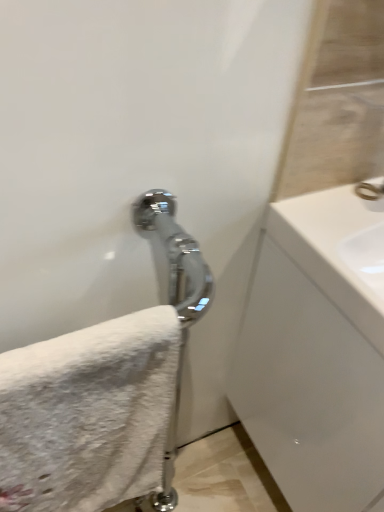
The image size is (384, 512). What do you see at coordinates (369, 191) in the screenshot?
I see `polished chrome faucet at upper right` at bounding box center [369, 191].

The height and width of the screenshot is (512, 384). I want to click on white fluffy towel at lower left, so click(x=88, y=414).

Is white fluffy towel at lower left looking in the opposite direction of polished chrome faucet at upper right?

That's not correct — white fluffy towel at lower left is not looking away from polished chrome faucet at upper right.

Considering the points (30, 501) and (371, 195), which point is in front, point (30, 501) or point (371, 195)?

The point (30, 501) is closer to the camera.

From a real-world perspective, does white fluffy towel at lower left sit lower than polished chrome faucet at upper right?

Yes, from a real-world perspective, white fluffy towel at lower left is below polished chrome faucet at upper right.

From a real-world perspective, does white fluffy towel at lower left stand above white glossy sink at right?

Indeed, from a real-world perspective, white fluffy towel at lower left stands above white glossy sink at right.

Which is nearer, (123, 422) or (340, 259)?

Point (123, 422) is closer to the camera than point (340, 259).

Looking at this image, is white glossy sink at right located within white fluffy towel at lower left?

No.

Is white fluffy towel at lower left beside white glossy sink at right?

white fluffy towel at lower left and white glossy sink at right are clearly separated.

Does point (361, 185) lie behind point (337, 431)?

Yes.

From the image's perspective, relative to white glossy sink at right, is polished chrome faucet at upper right above or below?

Based on their image positions, polished chrome faucet at upper right is located above white glossy sink at right.

From the picture: Between polished chrome faucet at upper right and white glossy sink at right, which one appears on the right side from the viewer's perspective?

white glossy sink at right.

Does white glossy sink at right turn towards polished chrome faucet at upper right?

No, white glossy sink at right is not facing towards polished chrome faucet at upper right.

From the image's perspective, between white glossy sink at right and polished chrome faucet at upper right, which one is located above?

From the image's view, polished chrome faucet at upper right is above.

Based on the photo, who is taller, white glossy sink at right or polished chrome faucet at upper right?

white glossy sink at right is taller.

Does white glossy sink at right lie behind polished chrome faucet at upper right?

No, it is not.

From the image's perspective, is polished chrome faucet at upper right over white fluffy towel at lower left?

Correct, polished chrome faucet at upper right appears higher than white fluffy towel at lower left in the image.

From a real-world perspective, is polished chrome faucet at upper right located higher than white fluffy towel at lower left?

Indeed, from a real-world perspective, polished chrome faucet at upper right stands above white fluffy towel at lower left.

Is polished chrome faucet at upper right behind white fluffy towel at lower left?

Yes, polished chrome faucet at upper right is further from the viewer.

Can you confirm if polished chrome faucet at upper right is shorter than white fluffy towel at lower left?

Yes.

Can you confirm if white glossy sink at right is taller than white fluffy towel at lower left?

Indeed, white glossy sink at right has a greater height compared to white fluffy towel at lower left.

Between white glossy sink at right and white fluffy towel at lower left, which one appears on the left side from the viewer's perspective?

white fluffy towel at lower left.

Looking at this image, is white glossy sink at right oriented towards white fluffy towel at lower left?

No, white glossy sink at right is not facing towards white fluffy towel at lower left.

The image size is (384, 512). I want to click on faucet lying behind the white fluffy towel at lower left, so click(369, 191).

In order to click on towel above the white glossy sink at right (from a real-world perspective) in this screenshot , I will do `click(88, 414)`.

Based on their spatial positions, is polished chrome faucet at upper right or white glossy sink at right closer to white fluffy towel at lower left?

white glossy sink at right is positioned closer to the anchor white fluffy towel at lower left.

When comparing their distances from polished chrome faucet at upper right, does white glossy sink at right or white fluffy towel at lower left seem further?

Among the two, white fluffy towel at lower left is located further to polished chrome faucet at upper right.

Based on the photo, which object lies further to the anchor point white glossy sink at right, polished chrome faucet at upper right or white fluffy towel at lower left?

white fluffy towel at lower left.

Considering their positions, is white fluffy towel at lower left positioned further to polished chrome faucet at upper right than white glossy sink at right?

Based on the image, white fluffy towel at lower left appears to be further to polished chrome faucet at upper right.

When comparing their distances from white glossy sink at right, does white fluffy towel at lower left or polished chrome faucet at upper right seem further?

The object further to white glossy sink at right is white fluffy towel at lower left.

Which object lies nearer to the anchor point white fluffy towel at lower left, white glossy sink at right or polished chrome faucet at upper right?

white glossy sink at right.

What are the coordinates of `faucet situated between white fluffy towel at lower left and white glossy sink at right from left to right` in the screenshot? It's located at (369, 191).